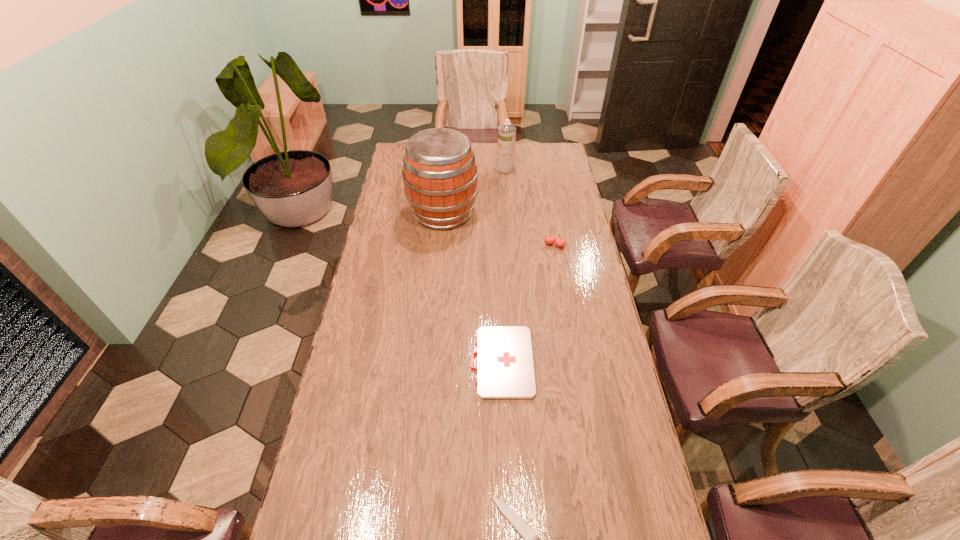
This screenshot has height=540, width=960. Find the location of `the tallest object`. the tallest object is located at coordinates (440, 175).

Locate an element on the screen. This screenshot has height=540, width=960. cider is located at coordinates (440, 175).

Locate an element on the screen. The width and height of the screenshot is (960, 540). aerosol can is located at coordinates (506, 141).

Where is `the farthest object`? the farthest object is located at coordinates (506, 141).

Find the location of a particular element. the third shortest object is located at coordinates (560, 242).

This screenshot has width=960, height=540. I want to click on cherry, so click(560, 242).

You are a GUI agent. You are given a task and a screenshot of the screen. Output one action in this format:
    pyautogui.click(x=<x>, y=<y>)
    Task: Click on the first-aid kit
    This screenshot has width=960, height=540.
    Given the screenshot: What is the action you would take?
    pyautogui.click(x=505, y=369)

Identify the location of the fourth farthest object. The width and height of the screenshot is (960, 540). (505, 369).

You are a GUI agent. You are given a task and a screenshot of the screen. Output one action in this format:
    pyautogui.click(x=<x>, y=<y>)
    Task: Click on the free spot located on the right of the cider
    
    Given the screenshot: What is the action you would take?
    pyautogui.click(x=563, y=213)

You are a GUI agent. You are given a task and a screenshot of the screen. Output one action in this format:
    pyautogui.click(x=<x>, y=<y>)
    Task: Click on the vacant area situated on the front of the fourth shortest object
    
    Given the screenshot: What is the action you would take?
    pyautogui.click(x=507, y=191)